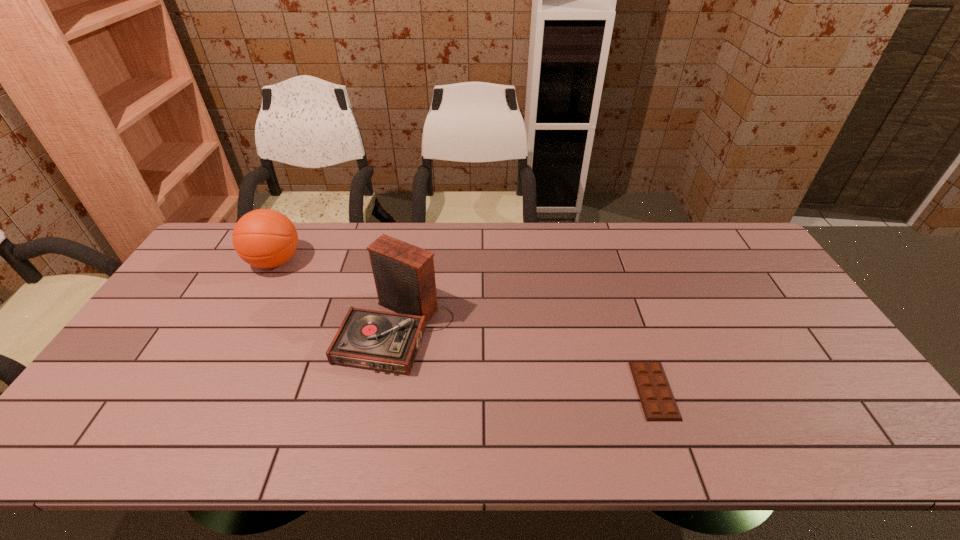
Where is `unoccupied area between the rightmost object and the second object from left to right`? unoccupied area between the rightmost object and the second object from left to right is located at coordinates (525, 360).

Locate an element on the screen. The image size is (960, 540). vacant region between the farthest object and the phonograph record is located at coordinates (336, 295).

Locate an element on the screen. The height and width of the screenshot is (540, 960). free area in between the rightmost object and the phonograph record is located at coordinates (525, 360).

Where is `object that is the second closest to the phonograph record`? The height and width of the screenshot is (540, 960). object that is the second closest to the phonograph record is located at coordinates (658, 403).

Identify the location of object that ranks as the second closest to the second object from left to right. The image size is (960, 540). click(658, 403).

Where is `vacant area that satisfies the following two spatial constraints: 1. on the front side of the shortest object; 2. on the left side of the basketball`? Image resolution: width=960 pixels, height=540 pixels. vacant area that satisfies the following two spatial constraints: 1. on the front side of the shortest object; 2. on the left side of the basketball is located at coordinates (205, 390).

Identify the location of vacant space that satisfies the following two spatial constraints: 1. on the front side of the leftmost object; 2. on the left side of the second object from left to right. The image size is (960, 540). (x=238, y=329).

Locate an element on the screen. This screenshot has width=960, height=540. free location that satisfies the following two spatial constraints: 1. on the front side of the chocolate bar; 2. on the left side of the second object from right to left is located at coordinates (386, 390).

Identify the location of vacant position in the image that satisfies the following two spatial constraints: 1. on the front side of the second object from right to left; 2. on the right side of the leftmost object. This screenshot has height=540, width=960. (238, 329).